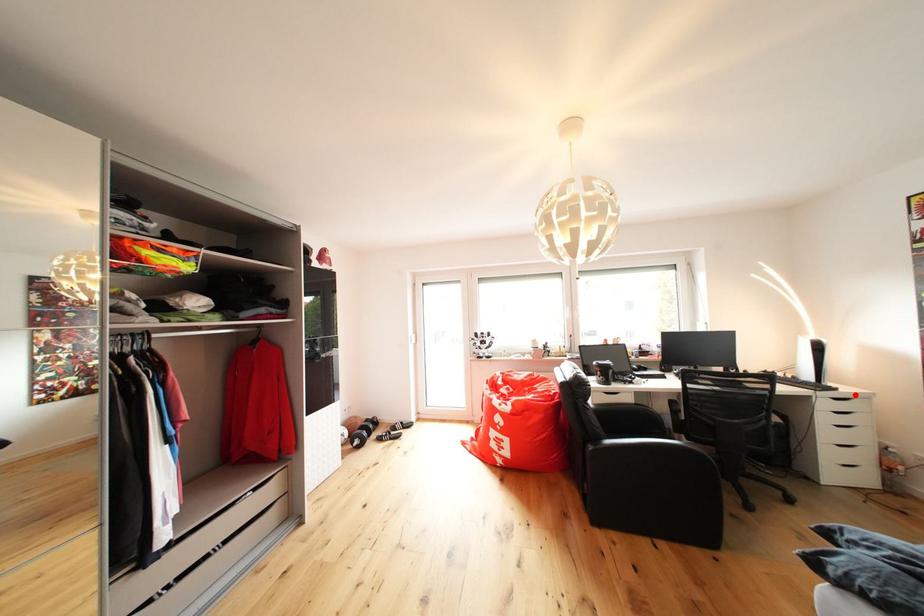
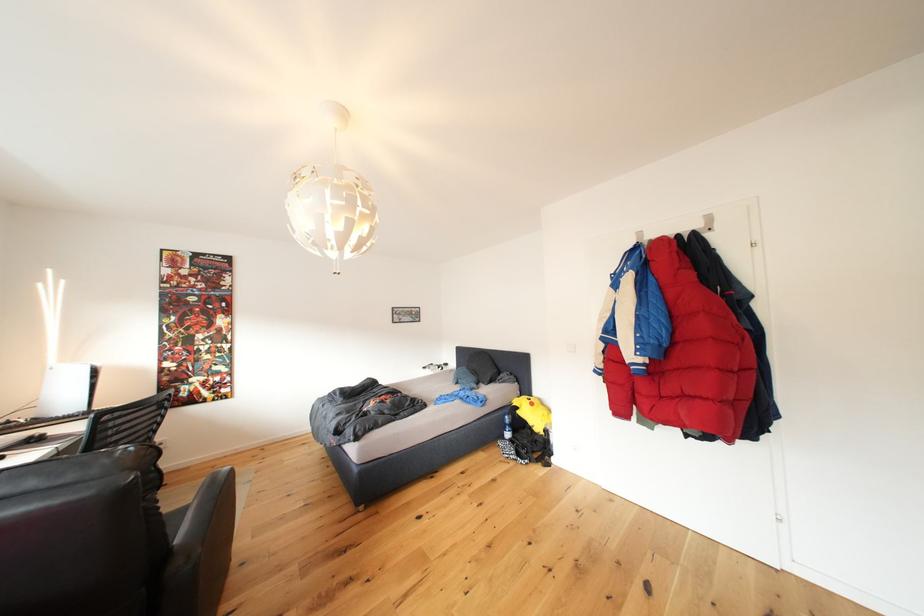
Question: I am providing you with two images of the same scene from different viewpoints. A red point is marked on the first image. At the location where the point appears in image 1, is it still visible in image 2?

Choices:
 (A) Yes
 (B) No

Answer: (B)